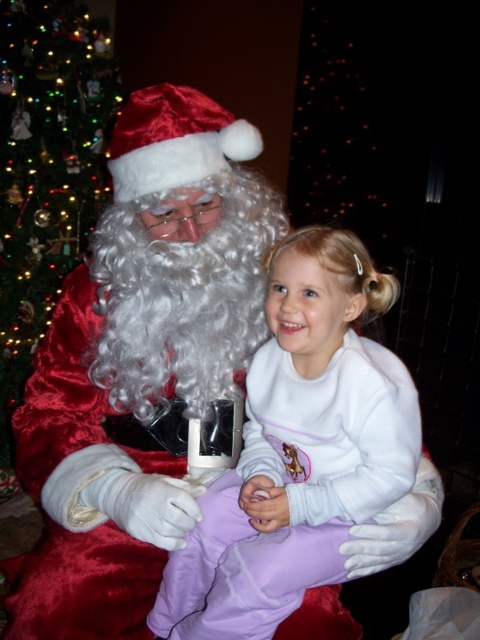
Question: Can you confirm if white fleece onesie at center is bigger than green velvet christmas tree at left?

Choices:
 (A) yes
 (B) no

Answer: (B)

Question: Does white fleece onesie at center appear on the right side of green velvet christmas tree at left?

Choices:
 (A) no
 (B) yes

Answer: (B)

Question: Among these points, which one is nearest to the camera?

Choices:
 (A) (282, 515)
 (B) (10, 52)

Answer: (A)

Question: Is white fleece onesie at center to the left of green velvet christmas tree at left from the viewer's perspective?

Choices:
 (A) no
 (B) yes

Answer: (A)